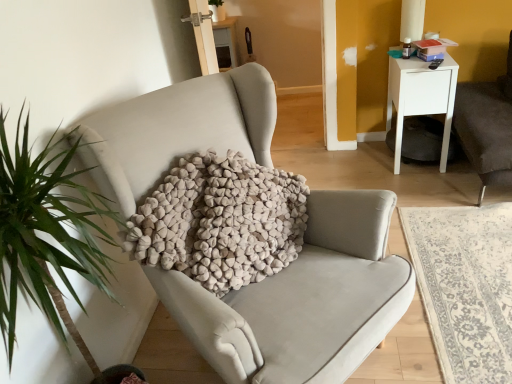
Question: Does white glossy nightstand at upper right have a lesser height compared to black plastic remote control at upper right?

Choices:
 (A) yes
 (B) no

Answer: (B)

Question: Does white glossy nightstand at upper right have a smaller size compared to black plastic remote control at upper right?

Choices:
 (A) yes
 (B) no

Answer: (B)

Question: Does white glossy nightstand at upper right have a greater width compared to black plastic remote control at upper right?

Choices:
 (A) yes
 (B) no

Answer: (A)

Question: Considering the relative sizes of white glossy nightstand at upper right and black plastic remote control at upper right in the image provided, is white glossy nightstand at upper right thinner than black plastic remote control at upper right?

Choices:
 (A) yes
 (B) no

Answer: (B)

Question: Is white glossy nightstand at upper right further to the viewer compared to black plastic remote control at upper right?

Choices:
 (A) yes
 (B) no

Answer: (B)

Question: Is white glossy nightstand at upper right far away from black plastic remote control at upper right?

Choices:
 (A) yes
 (B) no

Answer: (B)

Question: Is black plastic remote control at upper right taller than beige fabric chair at center?

Choices:
 (A) no
 (B) yes

Answer: (A)

Question: Are black plastic remote control at upper right and beige fabric chair at center located far from each other?

Choices:
 (A) no
 (B) yes

Answer: (B)

Question: Can you confirm if black plastic remote control at upper right is positioned to the right of beige fabric chair at center?

Choices:
 (A) no
 (B) yes

Answer: (B)

Question: Is black plastic remote control at upper right bigger than beige fabric chair at center?

Choices:
 (A) yes
 (B) no

Answer: (B)

Question: Can you confirm if black plastic remote control at upper right is shorter than beige fabric chair at center?

Choices:
 (A) yes
 (B) no

Answer: (A)

Question: Is black plastic remote control at upper right oriented away from beige fabric chair at center?

Choices:
 (A) yes
 (B) no

Answer: (B)

Question: Does beige fabric chair at center have a lesser width compared to textured beige pillow at center?

Choices:
 (A) yes
 (B) no

Answer: (B)